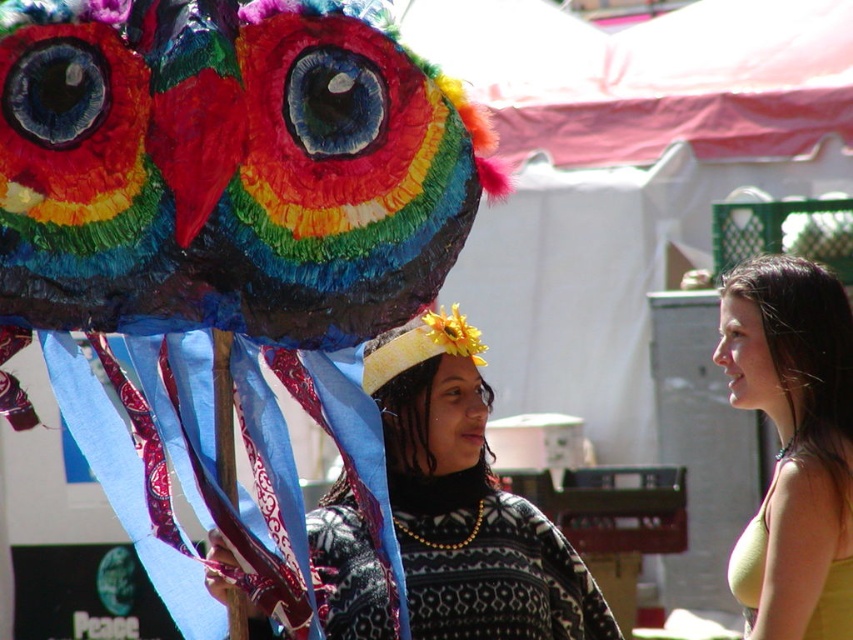
Question: Can you confirm if patterned sweater at center is positioned below yellow fabric top at center?

Choices:
 (A) yes
 (B) no

Answer: (A)

Question: Is patterned sweater at center above yellow fabric top at center?

Choices:
 (A) yes
 (B) no

Answer: (B)

Question: Which point is farther to the camera?

Choices:
 (A) (184, 19)
 (B) (503, 563)

Answer: (B)

Question: From the image, what is the correct spatial relationship of patterned sweater at center in relation to yellow fabric top at center?

Choices:
 (A) right
 (B) left

Answer: (B)

Question: Which point is farther to the camera?

Choices:
 (A) (825, 548)
 (B) (415, 74)
 (C) (461, 388)

Answer: (C)

Question: Which of the following is the farthest from the observer?

Choices:
 (A) patterned sweater at center
 (B) yellow fabric top at center

Answer: (B)